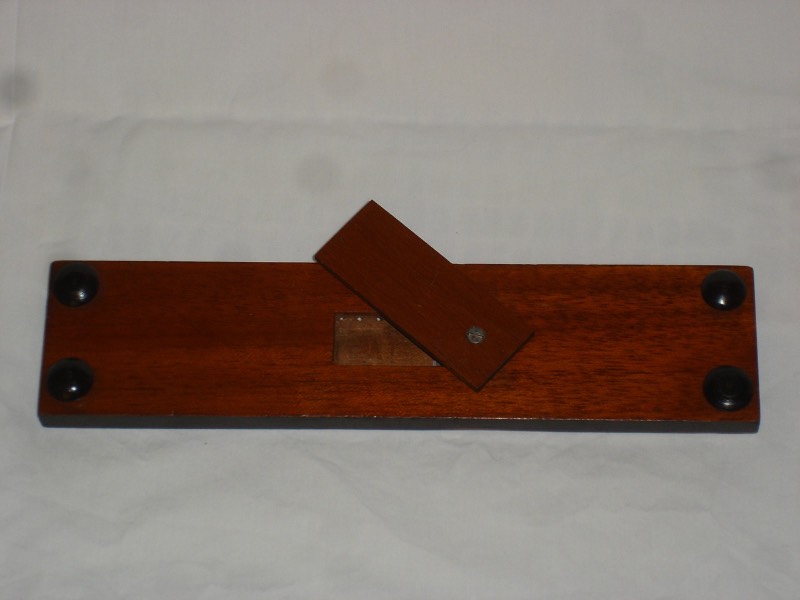
Where is `recessed area`? The image size is (800, 600). recessed area is located at coordinates (390, 344).